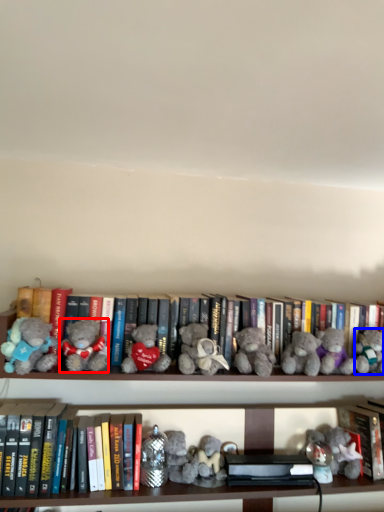
Question: Among these objects, which one is nearest to the camera, teddy bear (highlighted by a red box) or toy (highlighted by a blue box)?

Choices:
 (A) teddy bear
 (B) toy

Answer: (A)